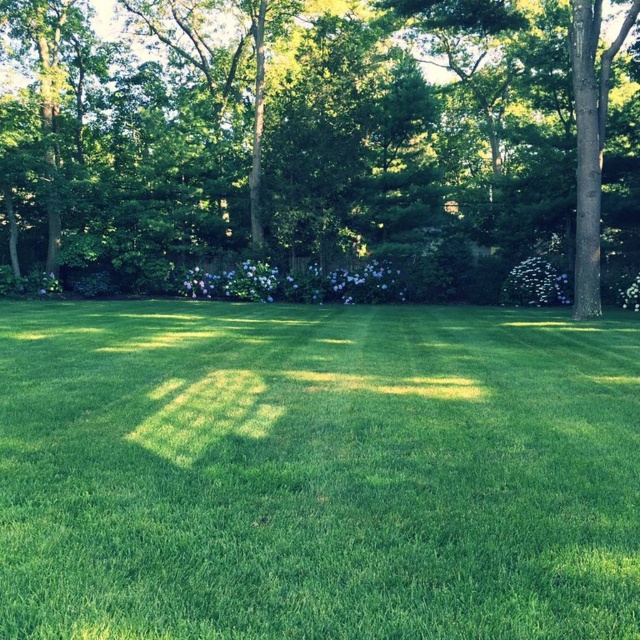
You are standing in the backyard and want to place a small garden bench. You see the green grass at center and the green leafy tree at center. Which location would be more suitable for placing the bench to ensure it stays dry during light rain?

The green grass at center is positioned under the green leafy tree at center, so placing the bench on the green grass at center would be more suitable as it is sheltered from direct rain by the tree.

You are standing in the backyard and want to place a 1.5 meter long garden hose on the green grass at center. Can you place the hose entirely on the grass without it hanging off the edge?

The distance of green grass at center from viewer is 1.65 meters, so yes, the garden hose can be placed entirely on the green grass at center since its length is shorter than the distance available.

You are standing in the backyard and want to place a small garden statue exactly at the center of the green grass at center. What are the coordinates where you should place it?

The coordinates for the center of the green grass at center are at point [316,472], so you should place the statue there.